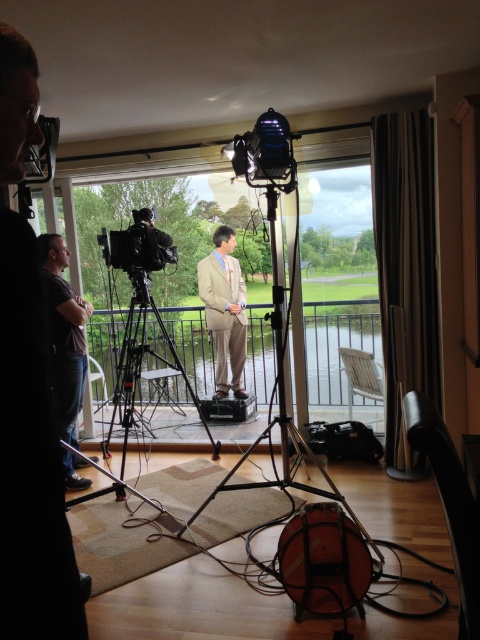
Question: Can you confirm if tan fabric suit at center is positioned to the left of black plastic video camera at upper center?

Choices:
 (A) yes
 (B) no

Answer: (A)

Question: Does black fabric at left have a smaller size compared to tan fabric suit at center?

Choices:
 (A) no
 (B) yes

Answer: (B)

Question: Which object appears farthest from the camera in this image?

Choices:
 (A) matte black shirt at left
 (B) black metal tripod at center

Answer: (A)

Question: Which of the following is the farthest from the observer?

Choices:
 (A) 289,189
 (B) 224,353

Answer: (B)

Question: Which object appears farthest from the camera in this image?

Choices:
 (A) matte black shirt at left
 (B) black metal tripod at center
 (C) black plastic video camera at upper center
 (D) black fabric at left

Answer: (A)

Question: Is tan fabric suit at center below black plastic video camera at upper center?

Choices:
 (A) yes
 (B) no

Answer: (A)